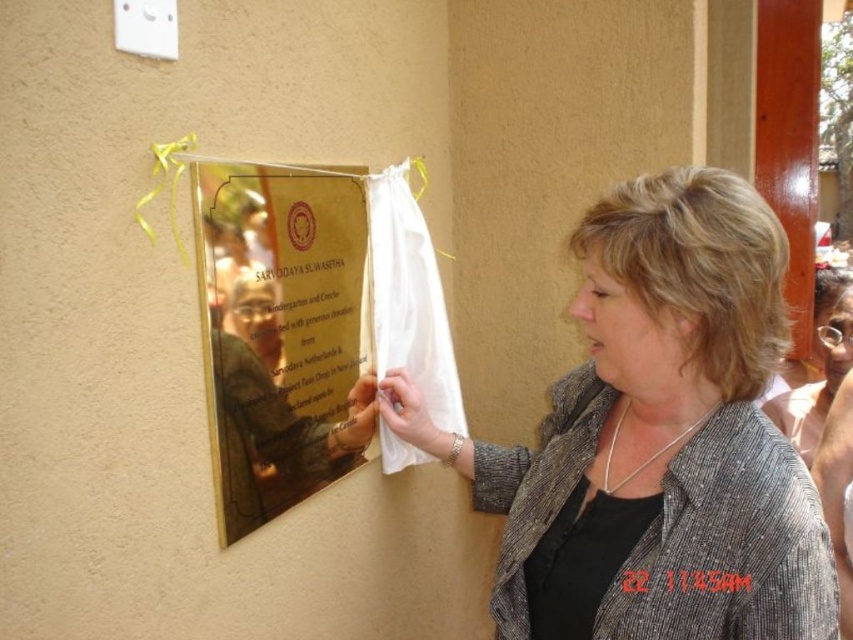
Question: Can you confirm if gray textured blazer at center is smaller than gold polished metal plaque at upper left?

Choices:
 (A) no
 (B) yes

Answer: (A)

Question: Does gray textured blazer at center lie behind gold polished metal plaque at upper left?

Choices:
 (A) yes
 (B) no

Answer: (B)

Question: Does gray textured blazer at center appear on the right side of gold polished metal plaque at upper left?

Choices:
 (A) yes
 (B) no

Answer: (A)

Question: Which of the following is the farthest from the observer?

Choices:
 (A) gray textured blazer at center
 (B) gold polished metal plaque at upper left

Answer: (B)

Question: Among these objects, which one is farthest from the camera?

Choices:
 (A) gray textured blazer at center
 (B) gold polished metal plaque at upper left

Answer: (B)